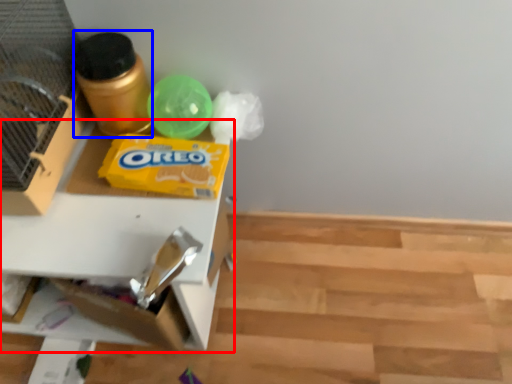
Question: Which of the following is the farthest to the observer, table (highlighted by a red box) or bottle (highlighted by a blue box)?

Choices:
 (A) table
 (B) bottle

Answer: (B)